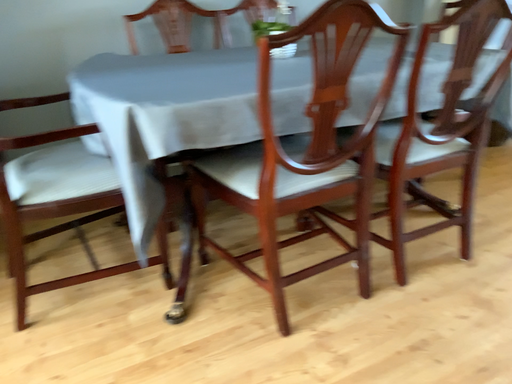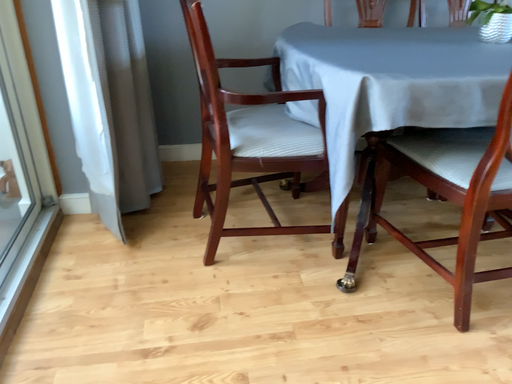
Question: How did the camera likely rotate when shooting the video?

Choices:
 (A) rotated right
 (B) rotated left

Answer: (B)